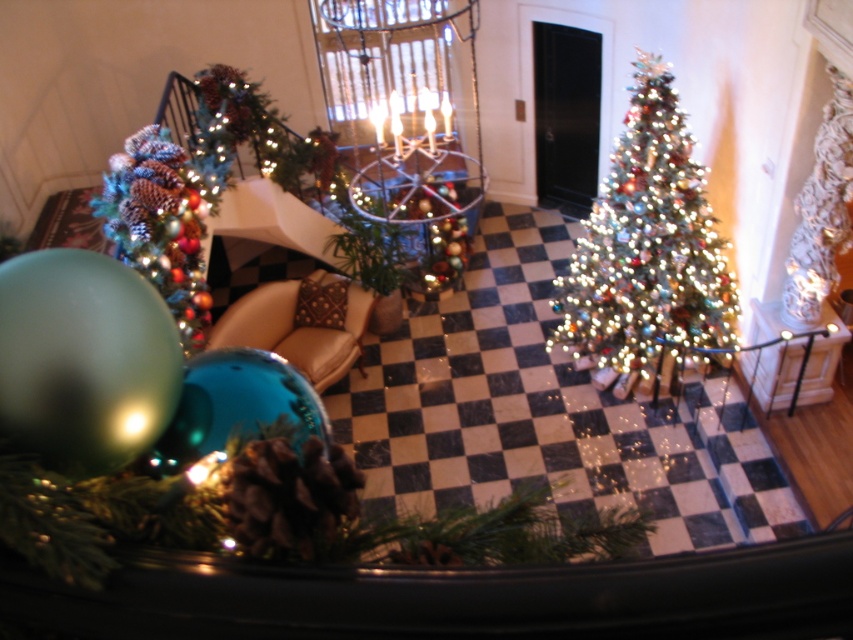
You are arranging holiday decorations on a mantel and have two ornaments to place. The shiny glass ornament at center and the shiny metallic ornament at left. Based on their positions, which ornament should you place first if you want to start from the left side of the mantel?

You should place the shiny metallic ornament at left first because it is positioned to the left of the shiny glass ornament at center, so starting from the left side of the mantel would require placing it first.